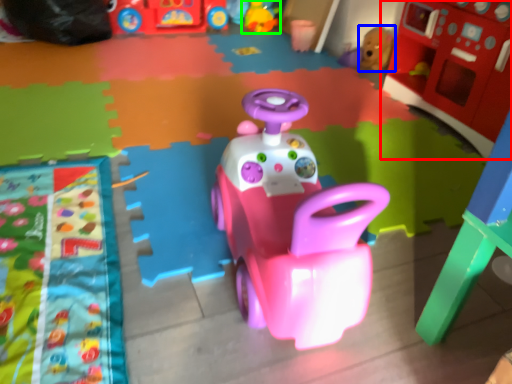
Question: Which object is the farthest from toy (highlighted by a red box)? Choose among these: toy (highlighted by a blue box) or toy (highlighted by a green box).

Choices:
 (A) toy
 (B) toy

Answer: (B)